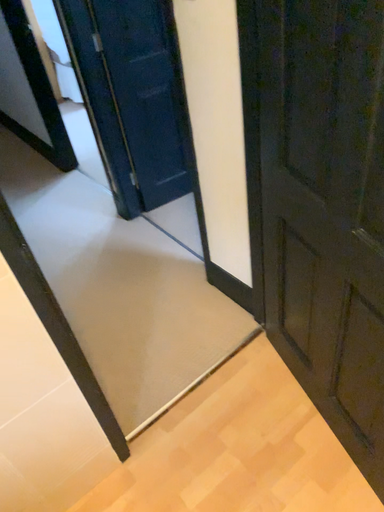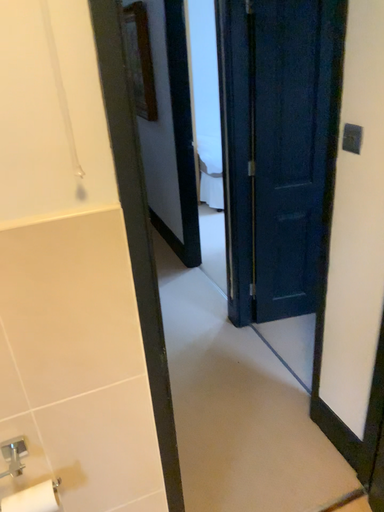
Question: Which way did the camera rotate in the video?

Choices:
 (A) rotated left
 (B) rotated right

Answer: (A)